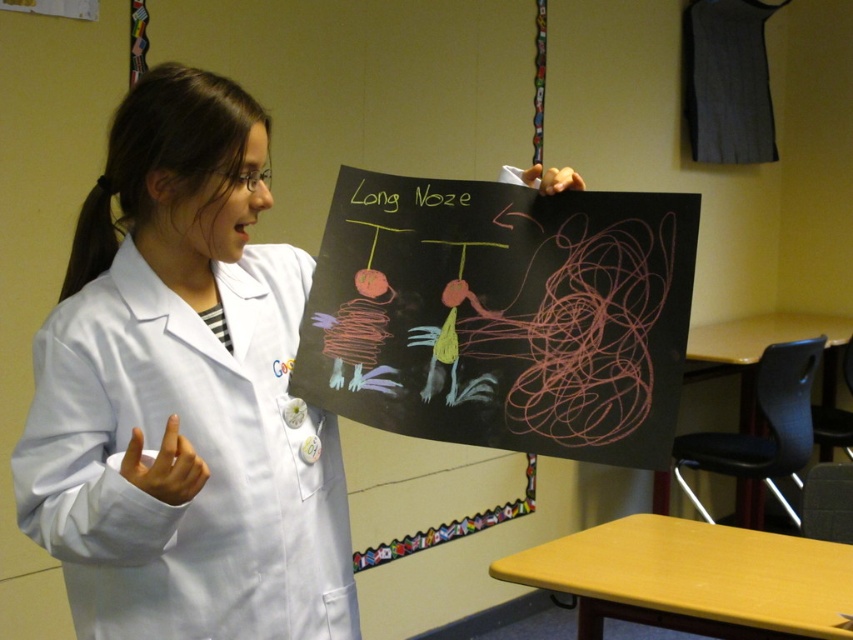
Question: Does white lab coat at center have a smaller size compared to green chalk writing at upper center?

Choices:
 (A) no
 (B) yes

Answer: (A)

Question: Is black chalkboard at center to the left of green chalk writing at upper center from the viewer's perspective?

Choices:
 (A) yes
 (B) no

Answer: (B)

Question: Among these points, which one is nearest to the camera?

Choices:
 (A) (364, 177)
 (B) (59, 310)

Answer: (B)

Question: Does white lab coat at center lie behind black chalkboard at center?

Choices:
 (A) yes
 (B) no

Answer: (B)

Question: Which object is positioned farthest from the white lab coat at center?

Choices:
 (A) green chalk writing at upper center
 (B) black chalkboard at center
 (C) white smooth lab coat at center

Answer: (A)

Question: Which object is the farthest from the black chalkboard at center?

Choices:
 (A) green chalk writing at upper center
 (B) white smooth lab coat at center
 (C) white lab coat at center

Answer: (C)